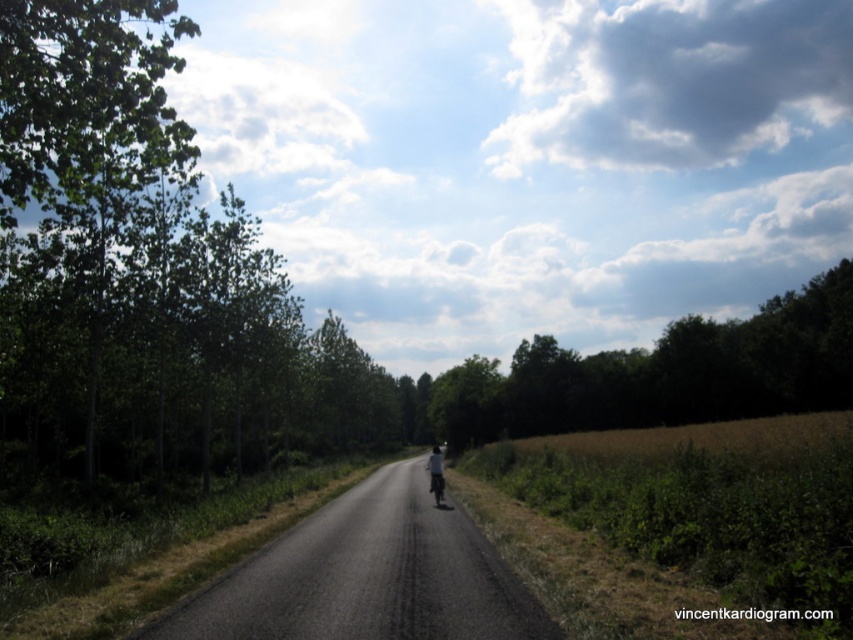
You are standing on the road in the image and see the green leafy tree at upper center and the dark gray fabric jacket at center. Which object is positioned to the right of the other?

The green leafy tree at upper center is to the right of the dark gray fabric jacket at center.

You are standing at the camera position in the image and want to reach the point at coordinates point [717,412]. If your walking speed is 3 feet per second, how many seconds will it take you to reach that point?

The point at coordinates point [717,412] is 201.35 feet away from the camera. At a walking speed of 3 feet per second, it would take approximately 67.12 seconds to reach the point.

You are a pedestrian standing on the side of the road in this rural area. You see both the dark gray fabric jacket at center and the shiny silver motorcycle at center. Which object is closer to you?

The dark gray fabric jacket at center is closer to you because it is positioned further to the viewer than the shiny silver motorcycle at center.